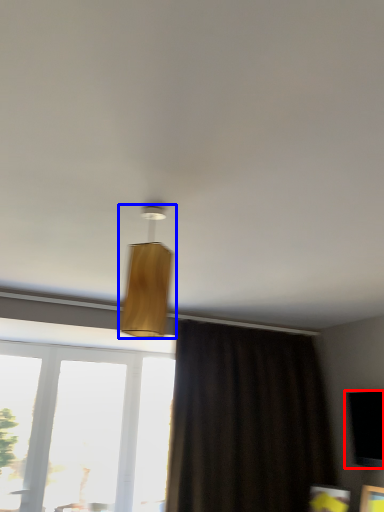
Question: Which object appears closest to the camera in this image, window screen (highlighted by a red box) or lamp (highlighted by a blue box)?

Choices:
 (A) window screen
 (B) lamp

Answer: (B)